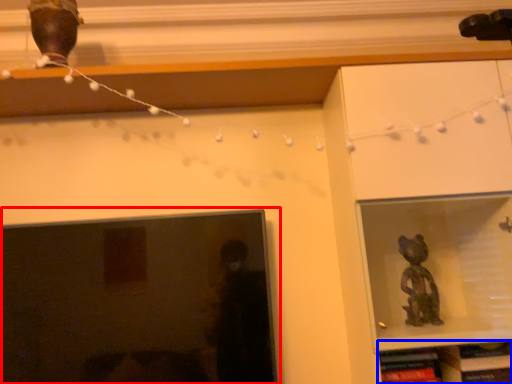
Question: Which of the following is the closest to the observer, picture frame (highlighted by a red box) or shelf (highlighted by a blue box)?

Choices:
 (A) picture frame
 (B) shelf

Answer: (A)